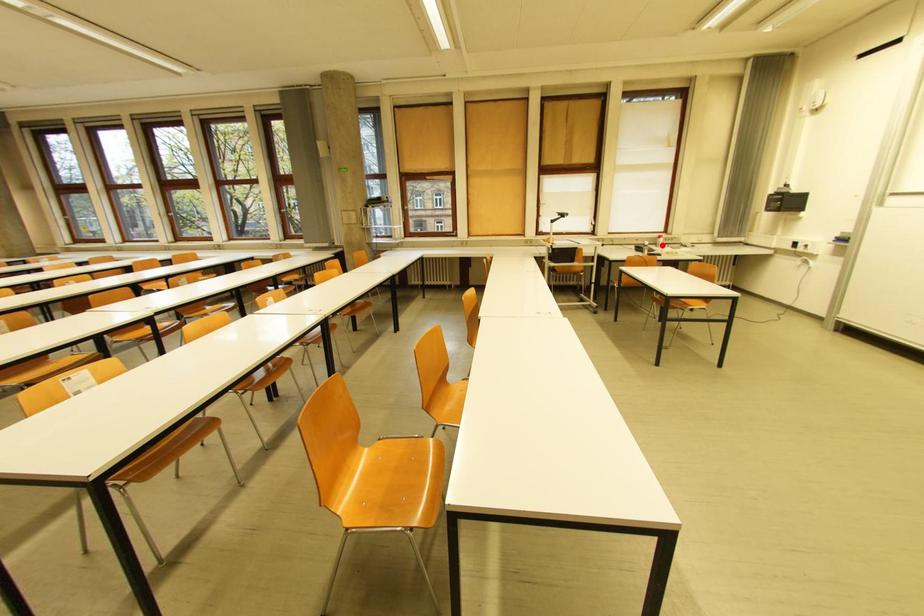
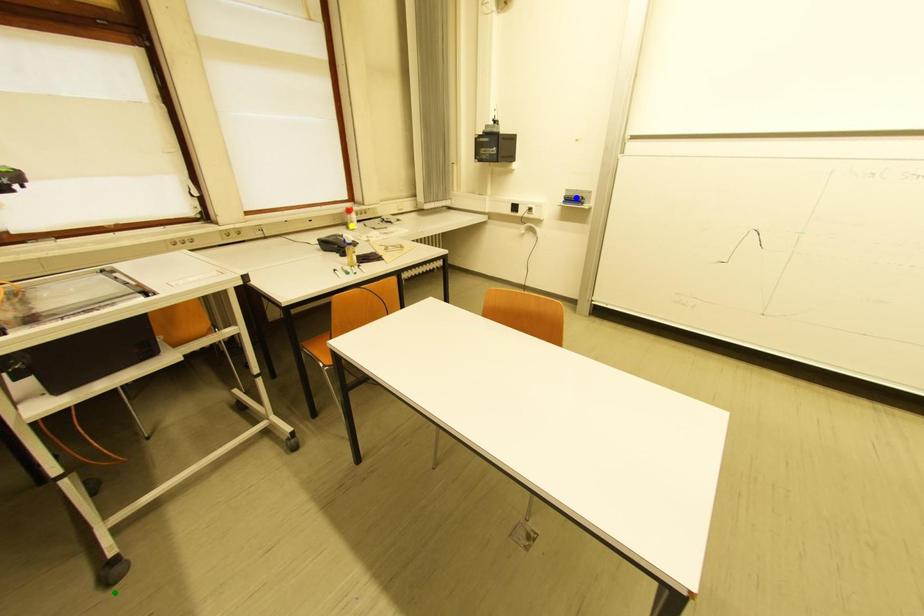
Question: I am providing you with two images of the same scene from different viewpoints. A red point is marked on the first image. You are given multiple points on the second image. In image 2, which mark is for the same physical point as the one in image 1?

Choices:
 (A) yellow point
 (B) green point
 (C) blue point

Answer: (A)